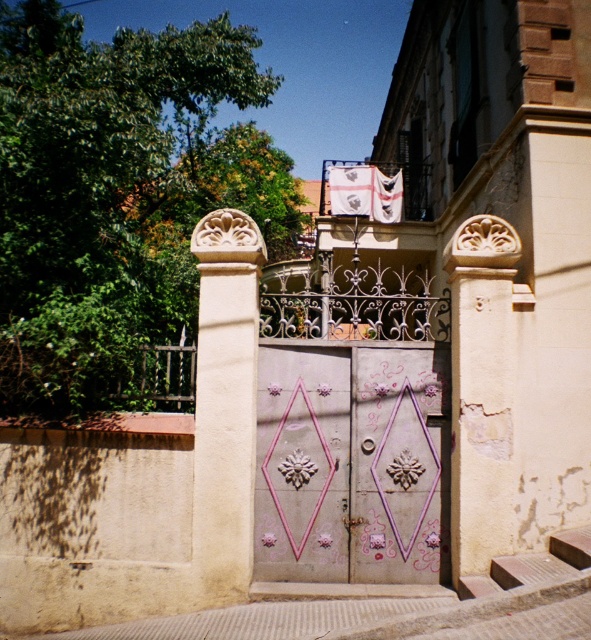
You are a delivery person trying to deliver a package to a house behind the gate. The gate has a pink painted wood door at center and a white stone column at center. The package requires a clearance of 26 inches between the door and the column to pass through. Can you fit the package through the space between them?

The pink painted wood door at center is 25.67 inches from the white stone column at center. Since the required clearance is 26 inches, the package cannot fit through the space between them as the distance is slightly less than required.

You are a delivery person trying to enter the residential area through the gate. The pink painted wood door at center is the entrance. However, you have a tall ladder that is 2 meters in height. Can you carry the ladder horizontally through the gate without hitting the white stone column at center?

A: The pink painted wood door at center is not as tall as the white stone column at center. Since the ladder is 2 meters tall and the door is shorter than the column, it is likely that the ladder will hit the column if carried horizontally through the gate.